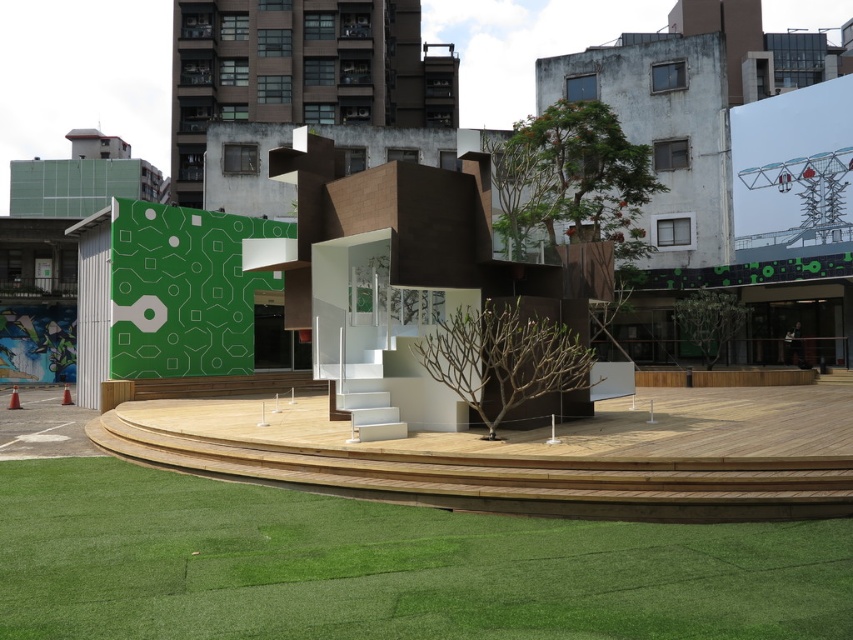
Can you confirm if green artificial turf at lower center is taller than green matte wall at upper left?

Incorrect, green artificial turf at lower center's height is not larger of green matte wall at upper left's.

Is green artificial turf at lower center above green matte wall at upper left?

No.

Is point (512, 557) closer to camera compared to point (187, 307)?

Yes, it is.

I want to click on green artificial turf at lower center, so click(x=386, y=564).